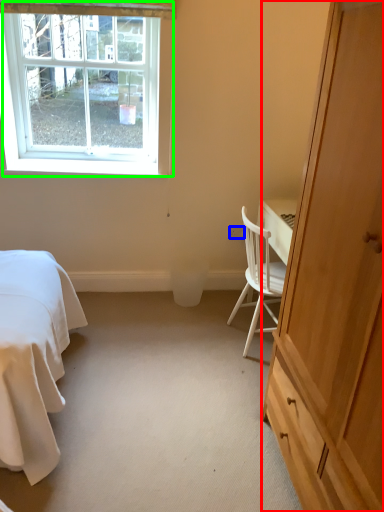
Question: Which object is positioned farthest from cabinetry (highlighted by a red box)? Select from power outlet (highlighted by a blue box) and window (highlighted by a green box).

Choices:
 (A) power outlet
 (B) window

Answer: (B)